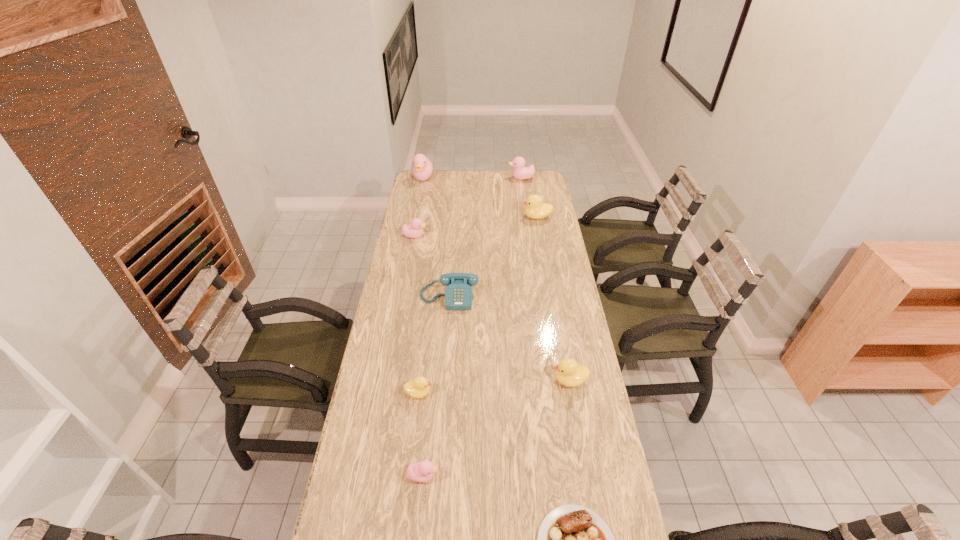
Find the location of a particular element. free location that satisfies the following two spatial constraints: 1. on the front-facing side of the second biggest pink duckling; 2. on the dial of the telephone is located at coordinates (538, 297).

Where is `vacant region that satisfies the following two spatial constraints: 1. on the beak of the biggest yellow duckling; 2. on the dial of the fifth nearest object`? This screenshot has height=540, width=960. vacant region that satisfies the following two spatial constraints: 1. on the beak of the biggest yellow duckling; 2. on the dial of the fifth nearest object is located at coordinates 551,297.

Image resolution: width=960 pixels, height=540 pixels. Identify the location of free space that satisfies the following two spatial constraints: 1. on the dial of the blue telephone; 2. on the front-facing side of the nearest duckling. (436, 476).